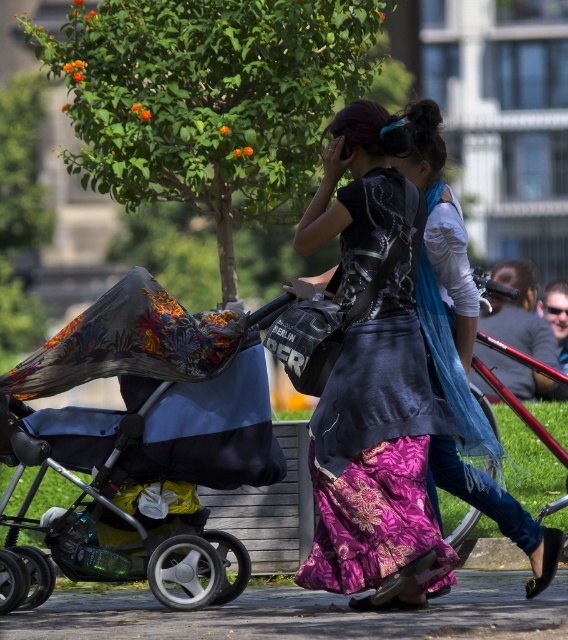
Question: Which point is farther to the camera?

Choices:
 (A) (558, 618)
 (B) (197, 428)
 (C) (314, 433)

Answer: (C)

Question: Which of the following is the farthest from the observer?

Choices:
 (A) paved concrete pavement at lower center
 (B) blue fabric stroller at left
 (C) green leafy tree at upper center
 (D) matte black top at center

Answer: (C)

Question: Which point is closer to the camera taking this photo?

Choices:
 (A) (265, 132)
 (B) (147, 397)
 (C) (402, 150)
 (D) (386, 164)

Answer: (B)

Question: Is matte black top at center to the left of matte black jacket at center from the viewer's perspective?

Choices:
 (A) yes
 (B) no

Answer: (A)

Question: Does blue fabric stroller at left appear over matte black top at center?

Choices:
 (A) no
 (B) yes

Answer: (A)

Question: In this image, where is blue fabric stroller at left located relative to matte black top at center?

Choices:
 (A) left
 (B) right

Answer: (A)